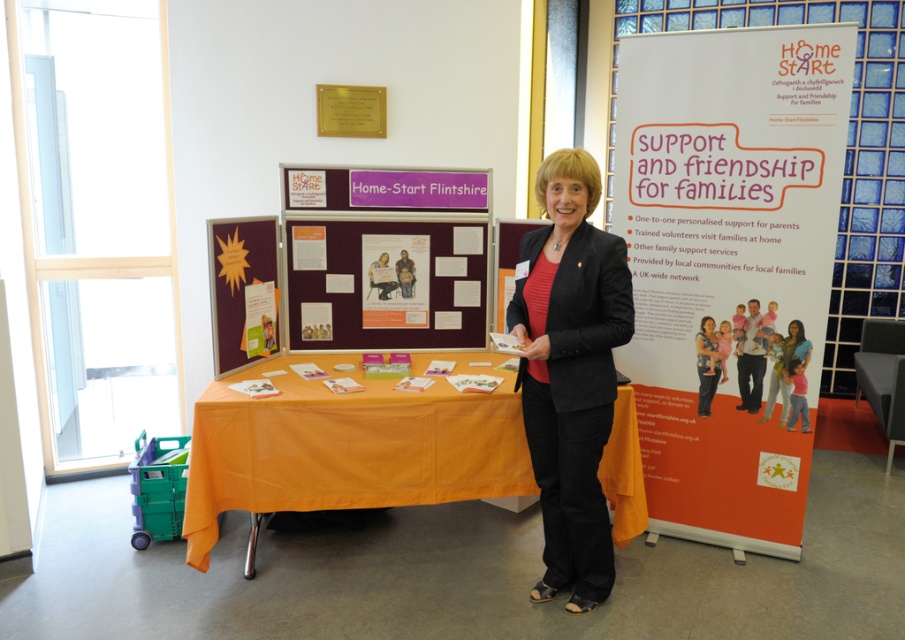
Describe the element at coordinates (350, 444) in the screenshot. Image resolution: width=905 pixels, height=640 pixels. I see `orange fabric table at center` at that location.

Which is below, orange fabric table at center or maroon fabric poster at center?

orange fabric table at center is lower down.

Consider the image. Who is more forward, (210, 529) or (379, 301)?

Positioned in front is point (210, 529).

The image size is (905, 640). I want to click on orange fabric table at center, so click(350, 444).

Does orange paper at right have a lesser width compared to orange fabric table at center?

Yes, orange paper at right is thinner than orange fabric table at center.

Image resolution: width=905 pixels, height=640 pixels. What do you see at coordinates (727, 262) in the screenshot? I see `orange paper at right` at bounding box center [727, 262].

In order to click on orange paper at right in this screenshot , I will do coord(727,262).

Between orange paper at right and maroon fabric poster at center, which one appears on the left side from the viewer's perspective?

maroon fabric poster at center is more to the left.

Who is taller, orange paper at right or maroon fabric poster at center?

With more height is orange paper at right.

Is point (759, 499) positioned in front of point (346, 328)?

Yes.

The height and width of the screenshot is (640, 905). In order to click on orange paper at right in this screenshot , I will do `click(727, 262)`.